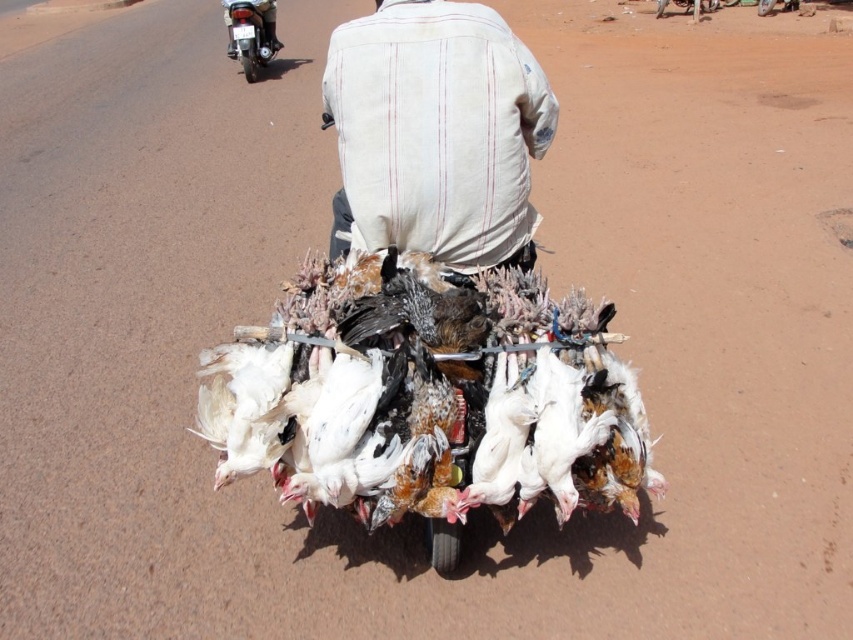
You are a delivery person who needs to ensure the chickens on the motorcycle are safely secured. Considering the size of the white feathered chicken at center compared to the white striped shirt at center, which object is wider and might require more space in the makeshift cage?

The white feathered chicken at center is wider than the white striped shirt at center, so it requires more space in the makeshift cage.

You are a traveler who needs to identify the position of the chickens relative to the rider. Based on the scene, where is the white feathered chicken at center located in relation to the white striped shirt at center?

The white feathered chicken at center is to the right of the white striped shirt at center.

You are a delivery person who needs to secure the white feathered chicken at center and the brushed metal motorcycle at upper left properly. Based on their positions, which object is closer to the ground?

The white feathered chicken at center is located below the brushed metal motorcycle at upper left, meaning it is closer to the ground than the motorcycle.